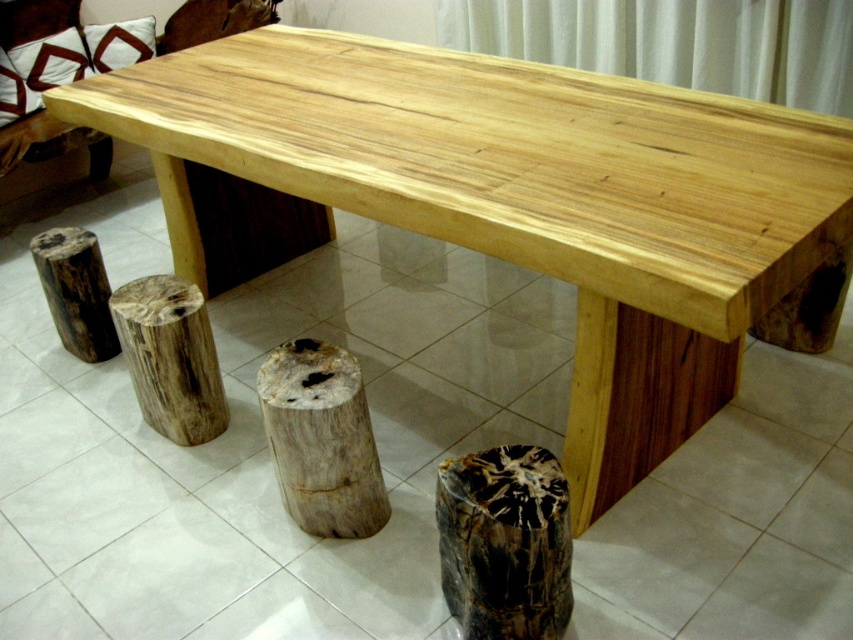
You are a delivery person who needs to place a large package that measures 1 meter in length between the natural wood stump at center and the brown rough wood stump at lower left on the rustic wooden table. Can the package fit between them without overlapping either stump?

The natural wood stump at center and the brown rough wood stump at lower left are 1.02 meters apart from each other. Since the package is 1 meter long, it can fit between them with a small gap of 2 centimeters remaining.

You are arranging a small potted plant on the rustic wooden table. You have two stumps available for placing the plant. Which stump, the natural wood stump at lower center or the brown rough wood stump at lower left, would provide a higher base for the plant?

The natural wood stump at lower center has a greater height compared to the brown rough wood stump at lower left, so placing the plant on the natural wood stump at lower center would provide a higher base.

From the picture: You are arranging a small potted plant between the natural wood stump at lower center and the brown rough wood stump at lower left. Which stump should the plant be placed closer to if you want it to be closer to the left side of the table?

The plant should be placed closer to the brown rough wood stump at lower left because the natural wood stump at lower center is positioned on the right side of the brown rough wood stump at lower left, meaning the brown rough wood stump is closer to the left side of the table.